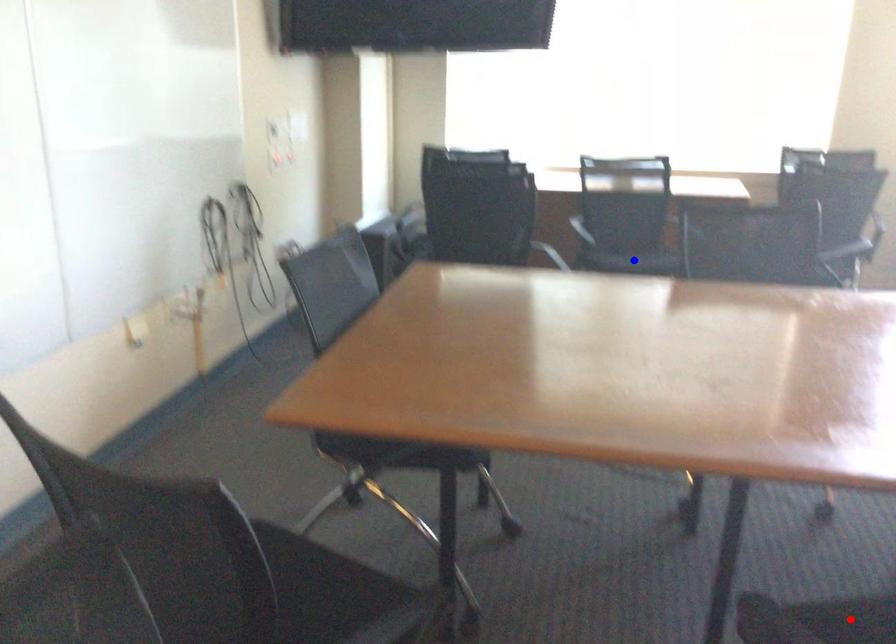
Question: In the image, two points are highlighted. Which point is nearer to the camera? Reply with the corresponding letter.

Choices:
 (A) blue point
 (B) red point

Answer: (B)